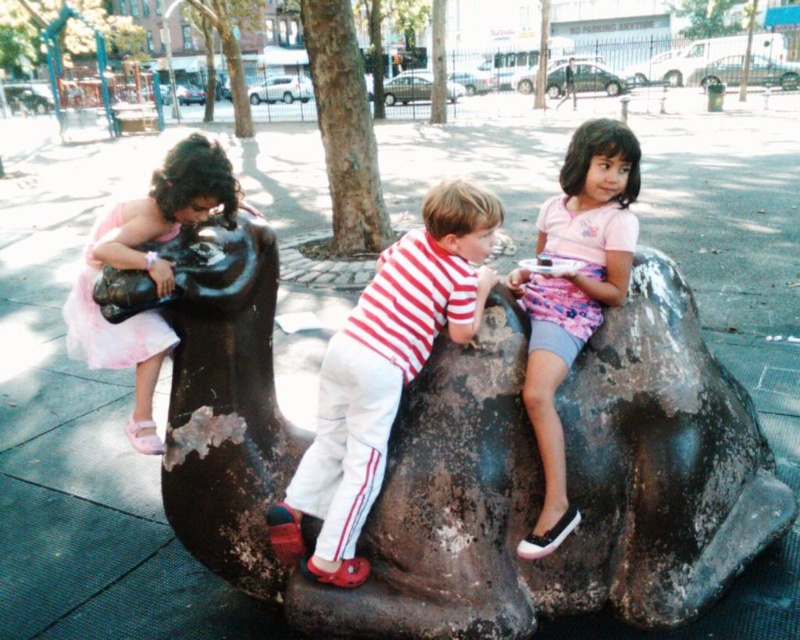
You are a photographer trying to capture the two pink clothing items in the scene. The pink fabric skirt at upper right and the pink tulle dress at left are both in your view. Which of these two items appears wider in the image?

The pink tulle dress at left appears wider than the pink fabric skirt at upper right.